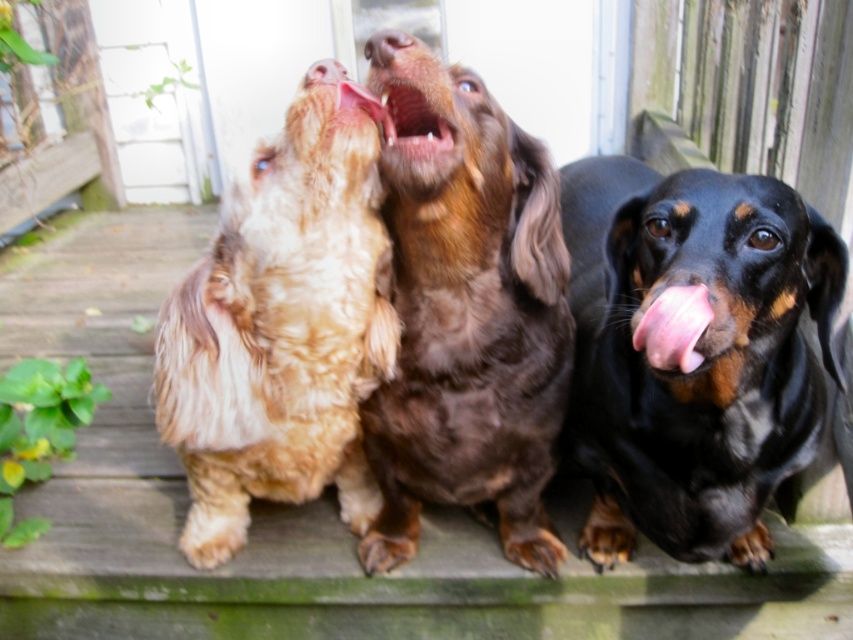
You are a photographer trying to capture a closeup of the brown fur dog at center and the pink glossy tongue at center. Given that your camera can only focus on objects wider than 10 cm, can both subjects be captured clearly?

The brown fur dog at center is wider than the pink glossy tongue at center. Since the camera requires objects wider than 10 cm to focus, we need to know the exact width of the brown fur dog at center. However, the description only states that it is wider than the tongue but does not provide specific measurements. Without the exact width of the dog, we cannot confirm if both meet the 10 cm requirement.

You are standing on the wooden deck where the three dachshunds are sitting. You want to place a treat between the two points marked as point (527, 513) and point (444, 122). Which point should you place the treat closer to so that it is nearer to the dachshund that is closer to you?

You should place the treat closer to point (527, 513) because it is closer to you than point (444, 122), so the dachshund nearest to you will have easier access.